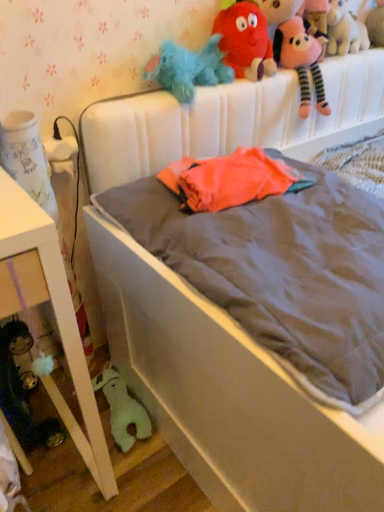
Question: Considering the relative sizes of white fabric bed at center and pink plush unicorn at upper right, which appears as the second toy when viewed from the right, in the image provided, is white fabric bed at center taller than pink plush unicorn at upper right, which appears as the second toy when viewed from the right,?

Choices:
 (A) yes
 (B) no

Answer: (A)

Question: Is white fabric bed at center not close to pink plush unicorn at upper right, acting as the second toy starting from the top?

Choices:
 (A) no
 (B) yes

Answer: (A)

Question: Does white fabric bed at center lie behind pink plush unicorn at upper right, acting as the second toy starting from the top?

Choices:
 (A) yes
 (B) no

Answer: (B)

Question: From a real-world perspective, is white fabric bed at center under pink plush unicorn at upper right, which appears as the second toy when viewed from the right?

Choices:
 (A) no
 (B) yes

Answer: (B)

Question: Is white fabric bed at center positioned beyond the bounds of pink plush unicorn at upper right, which appears as the second toy when viewed from the right?

Choices:
 (A) no
 (B) yes

Answer: (B)

Question: Is white fabric bed at center facing towards pink plush unicorn at upper right, which appears as the second toy when viewed from the right?

Choices:
 (A) yes
 (B) no

Answer: (B)

Question: Can you confirm if pink plush unicorn at upper right, which appears as the second toy when viewed from the right, is shorter than fuzzy beige stuffed animal at upper right, arranged as the 1th toy when viewed from the top?

Choices:
 (A) yes
 (B) no

Answer: (B)

Question: Can you confirm if pink plush unicorn at upper right, acting as the second toy starting from the top, is positioned to the left of fuzzy beige stuffed animal at upper right, arranged as the 1th toy when viewed from the top?

Choices:
 (A) no
 (B) yes

Answer: (B)

Question: Can you confirm if pink plush unicorn at upper right, acting as the second toy starting from the top, is thinner than fuzzy beige stuffed animal at upper right, which is the 1th toy from right to left?

Choices:
 (A) no
 (B) yes

Answer: (B)

Question: From the image's perspective, is pink plush unicorn at upper right, marked as the 4th toy in a bottom-to-top arrangement, above fuzzy beige stuffed animal at upper right, acting as the fifth toy starting from the left?

Choices:
 (A) yes
 (B) no

Answer: (B)

Question: Considering the relative positions of pink plush unicorn at upper right, marked as the 4th toy in a bottom-to-top arrangement, and fuzzy beige stuffed animal at upper right, marked as the fifth toy in a bottom-to-top arrangement, in the image provided, is pink plush unicorn at upper right, marked as the 4th toy in a bottom-to-top arrangement, to the right of fuzzy beige stuffed animal at upper right, marked as the fifth toy in a bottom-to-top arrangement, from the viewer's perspective?

Choices:
 (A) no
 (B) yes

Answer: (A)

Question: From a real-world perspective, is pink plush unicorn at upper right, marked as the 4th toy in a bottom-to-top arrangement, physically below fuzzy beige stuffed animal at upper right, acting as the fifth toy starting from the left?

Choices:
 (A) yes
 (B) no

Answer: (B)

Question: Does fluffy plush toys at upper right have a smaller size compared to green plush toy at lower left, positioned as the first toy in left-to-right order?

Choices:
 (A) no
 (B) yes

Answer: (A)